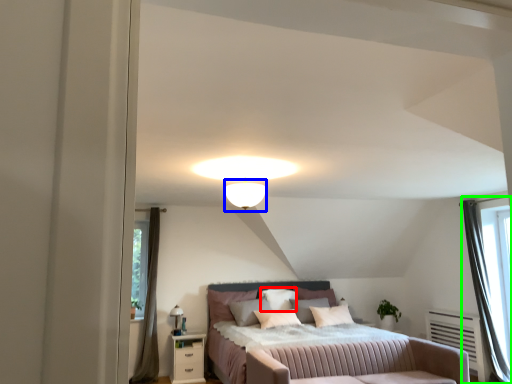
Question: Considering the real-world distances, which object is closest to pillow (highlighted by a red box)? lighting (highlighted by a blue box) or curtain (highlighted by a green box).

Choices:
 (A) lighting
 (B) curtain

Answer: (A)